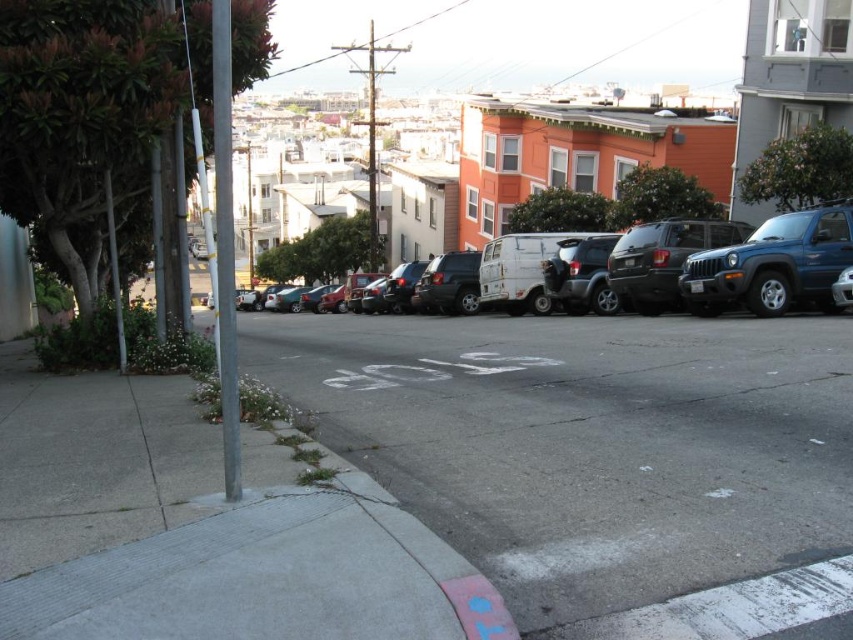
Question: Does matte white van at center appear on the right side of silver metallic pole at left?

Choices:
 (A) yes
 (B) no

Answer: (B)

Question: Which object appears closest to the camera in this image?

Choices:
 (A) matte white van at center
 (B) silver metallic pole at left

Answer: (B)

Question: Which object appears farthest from the camera in this image?

Choices:
 (A) matte white van at center
 (B) blue metallic suv at right

Answer: (B)

Question: Among these points, which one is farthest from the camera?

Choices:
 (A) (811, 214)
 (B) (276, 259)
 (C) (229, 352)

Answer: (B)

Question: Does matte white van at center appear on the right side of blue metallic suv at right?

Choices:
 (A) no
 (B) yes

Answer: (A)

Question: Where is matte white van at center located in relation to blue metallic suv at right in the image?

Choices:
 (A) above
 (B) below

Answer: (A)